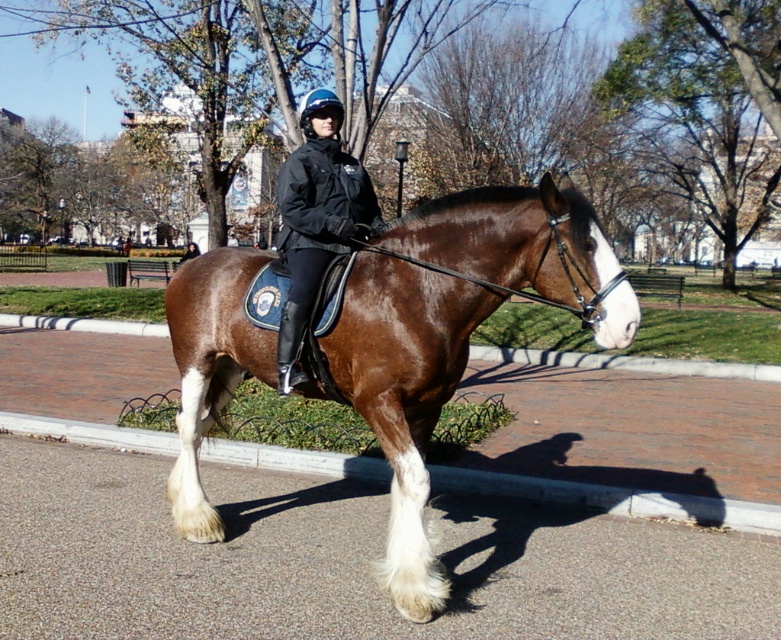
What do you see at coordinates (405, 396) in the screenshot? The image size is (781, 640). I see `brown glossy horse at center` at bounding box center [405, 396].

Who is more forward, (x=547, y=182) or (x=351, y=177)?

Point (x=547, y=182) is more forward.

Is point (608, 269) less distant than point (298, 349)?

Yes, point (608, 269) is closer to viewer.

Locate an element on the screen. This screenshot has height=640, width=781. brown glossy horse at center is located at coordinates (405, 396).